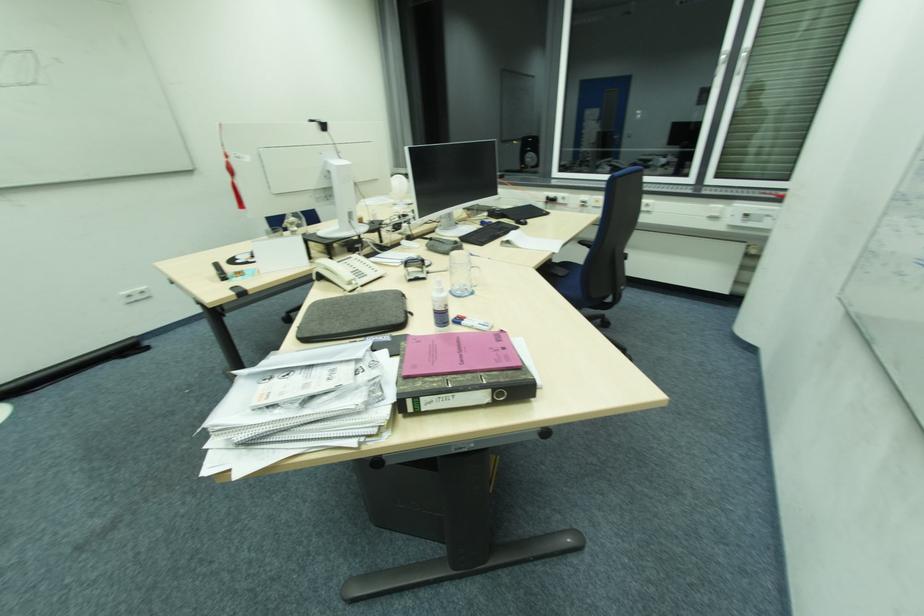
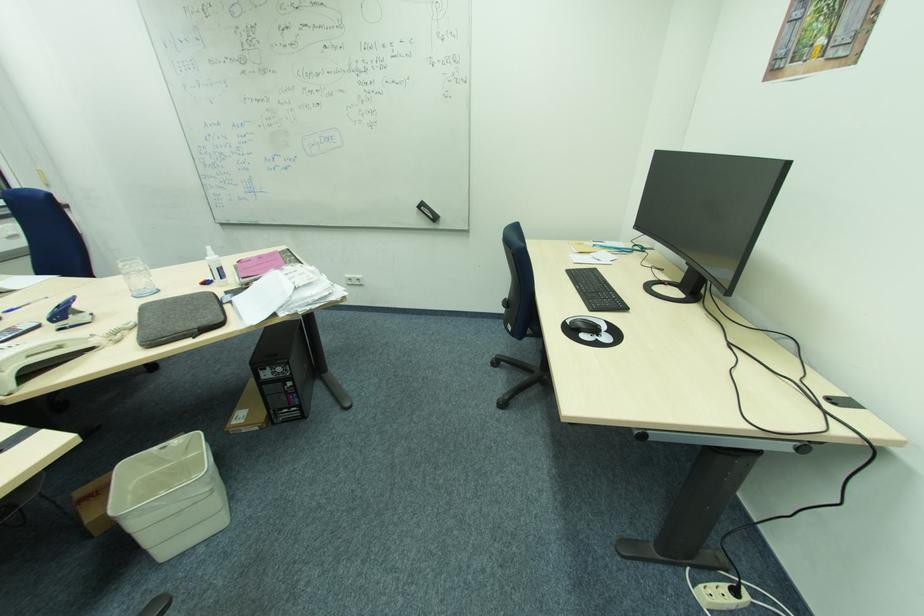
Locate, in the second image, the point that corresponds to point 436,310 in the first image.

(221, 268)